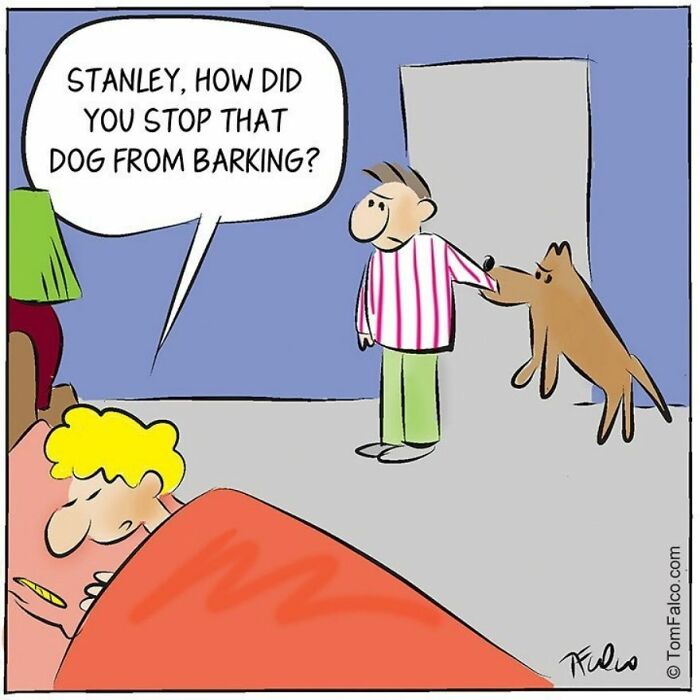
At what (x,y) coordinates should I click in order to perform the action: click on red lamp base. Please return your answer as a coordinate pair (x, y). This screenshot has width=700, height=700. Looking at the image, I should click on (52, 344).